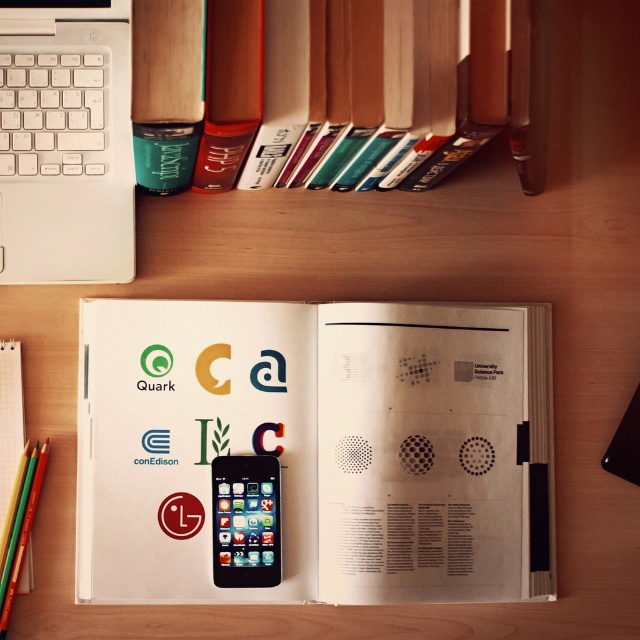
Question: Is teal matte cup at upper left above black matte smartphone at center?

Choices:
 (A) no
 (B) yes

Answer: (B)

Question: Which point is farther to the camera?

Choices:
 (A) white paper at center
 (B) black matte smartphone at center
 (C) white matte laptop at upper left
 (D) teal matte cup at upper left

Answer: (A)

Question: Which point is closer to the camera taking this photo?

Choices:
 (A) (529, 170)
 (B) (147, 310)
 (C) (227, 499)

Answer: (C)

Question: Can you confirm if white paper at center is thinner than teal matte cup at upper left?

Choices:
 (A) yes
 (B) no

Answer: (B)

Question: Can you confirm if teal matte cup at upper left is thinner than black matte smartphone at center?

Choices:
 (A) no
 (B) yes

Answer: (A)

Question: Which point is farther from the camera taking this photo?

Choices:
 (A) (227, 598)
 (B) (531, 125)
 (C) (106, 273)

Answer: (C)